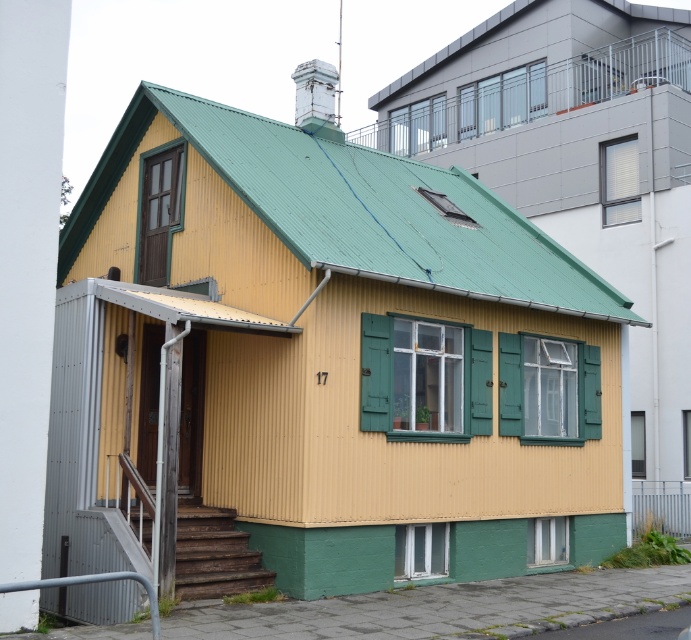
Question: Which point appears farthest from the camera in this image?

Choices:
 (A) (158, 237)
 (B) (634, 189)

Answer: (B)

Question: Where is green wood door at upper left located in relation to green wooden shutter at upper right in the image?

Choices:
 (A) above
 (B) below

Answer: (B)

Question: Does green wood door at upper left appear on the left side of green wooden shutter at upper right?

Choices:
 (A) yes
 (B) no

Answer: (A)

Question: Is green wood door at upper left thinner than green wooden shutter at upper right?

Choices:
 (A) no
 (B) yes

Answer: (A)

Question: Among these objects, which one is nearest to the camera?

Choices:
 (A) green wooden shutter at upper right
 (B) green wood door at upper left

Answer: (B)